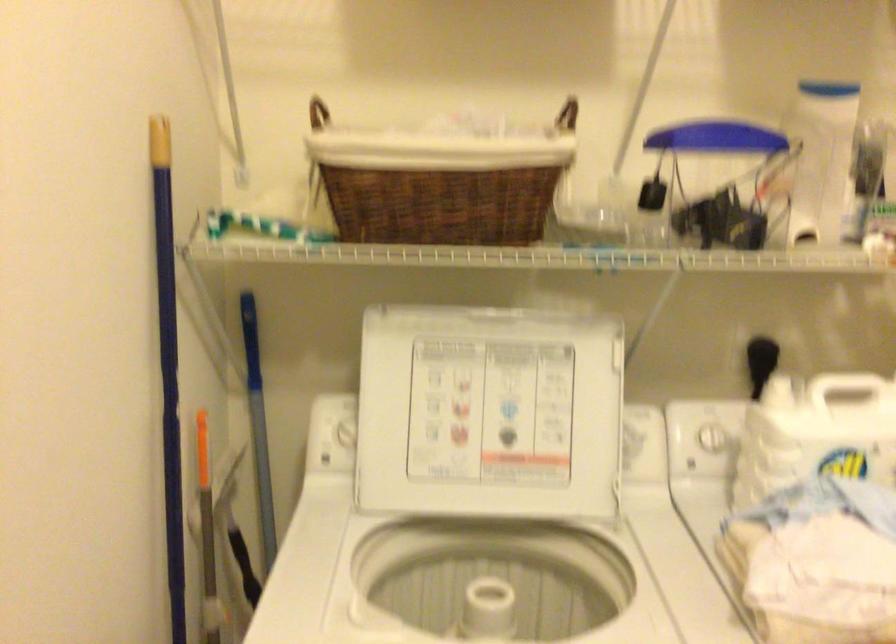
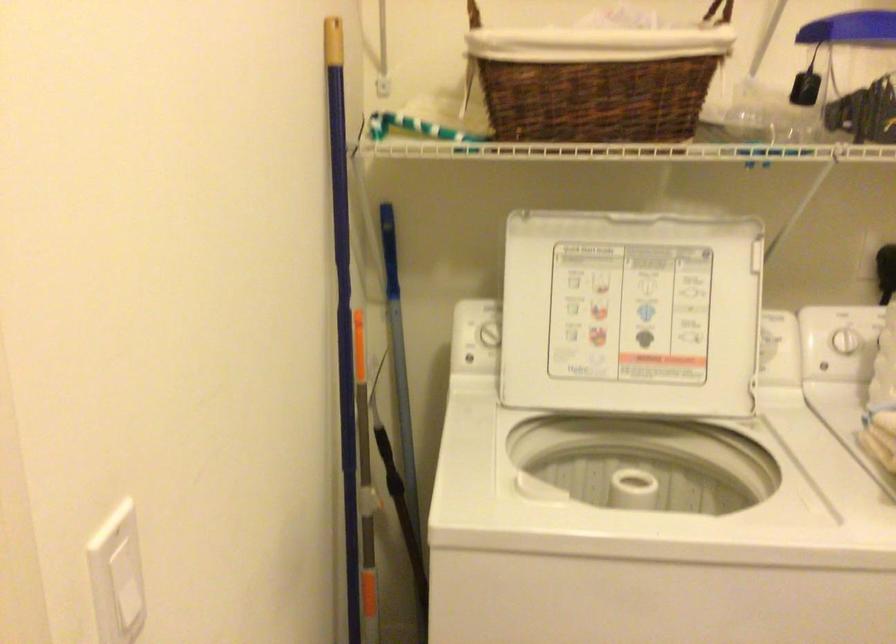
In the second image, find the point that corresponds to the point at 709,442 in the first image.

(845, 341)